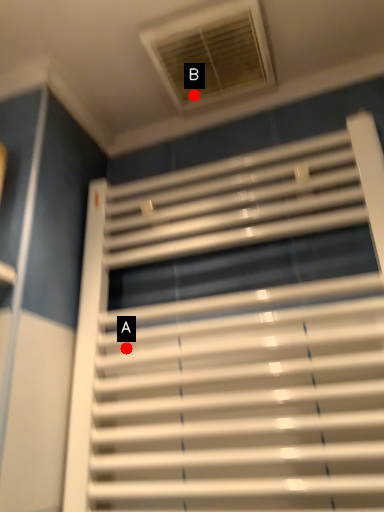
Question: Two points are circled on the image, labeled by A and B beside each circle. Among these points, which one is nearest to the camera?

Choices:
 (A) A is closer
 (B) B is closer

Answer: (A)